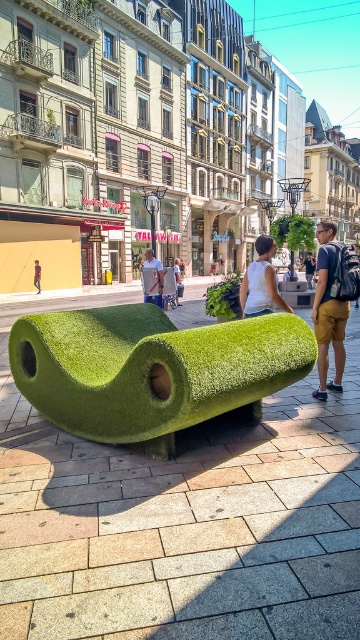
Which is more to the left, green grass bench at center or green tufted bench at center?

From the viewer's perspective, green tufted bench at center appears more on the left side.

At what (x,y) coordinates should I click in order to perform the action: click on green grass bench at center. Please return your answer as a coordinate pair (x, y). This screenshot has height=640, width=360. Looking at the image, I should click on (182, 520).

Locate an element on the screen. green grass bench at center is located at coordinates (182, 520).

Is khaki cotton shorts at lower right behind white cotton t-shirt at center?

No.

The height and width of the screenshot is (640, 360). Find the location of `khaki cotton shorts at lower right`. khaki cotton shorts at lower right is located at coordinates (333, 301).

Is green tufted bench at center above white fabric shirt at center?

No, green tufted bench at center is not above white fabric shirt at center.

Is point (56, 413) farther from viewer compared to point (270, 308)?

No, (56, 413) is in front of (270, 308).

Does point (48, 340) come farther from viewer compared to point (261, 259)?

No, (48, 340) is closer to viewer.

Find the location of a particular element. The height and width of the screenshot is (640, 360). green tufted bench at center is located at coordinates (151, 371).